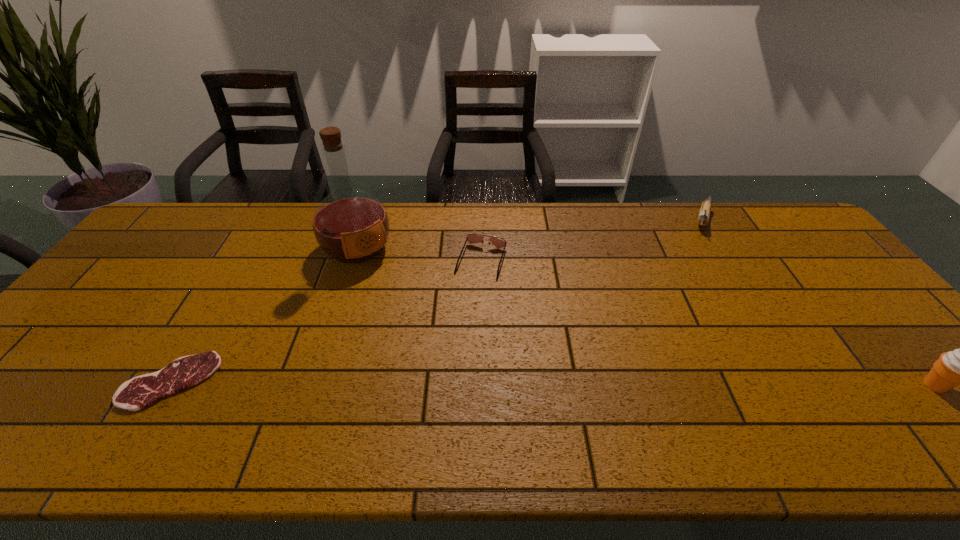
Find the location of a particular element. The image size is (960, 540). the shortest object is located at coordinates (141, 391).

Where is `steak`? steak is located at coordinates (141, 391).

Where is `liquor`? The height and width of the screenshot is (540, 960). liquor is located at coordinates (350, 225).

Identify the location of the tallest object. The height and width of the screenshot is (540, 960). (350, 225).

You are a GUI agent. You are given a task and a screenshot of the screen. Output one action in this format:
    pyautogui.click(x=<x>, y=<y>)
    Task: Click on the third object from right to left
    
    Given the screenshot: What is the action you would take?
    pyautogui.click(x=471, y=238)

At what (x,y) coordinates should I click in order to perform the action: click on sunglasses. Please return your answer as a coordinate pair (x, y). The width and height of the screenshot is (960, 540). Looking at the image, I should click on (471, 238).

Image resolution: width=960 pixels, height=540 pixels. In order to click on the third tallest object in this screenshot , I will do `click(703, 218)`.

I want to click on banana, so click(703, 218).

This screenshot has width=960, height=540. I want to click on free spot located 0.390m on the right of the shortest object, so (380, 381).

The height and width of the screenshot is (540, 960). What are the coordinates of `vacant space located 0.090m on the front label of the liquor` in the screenshot? It's located at (387, 285).